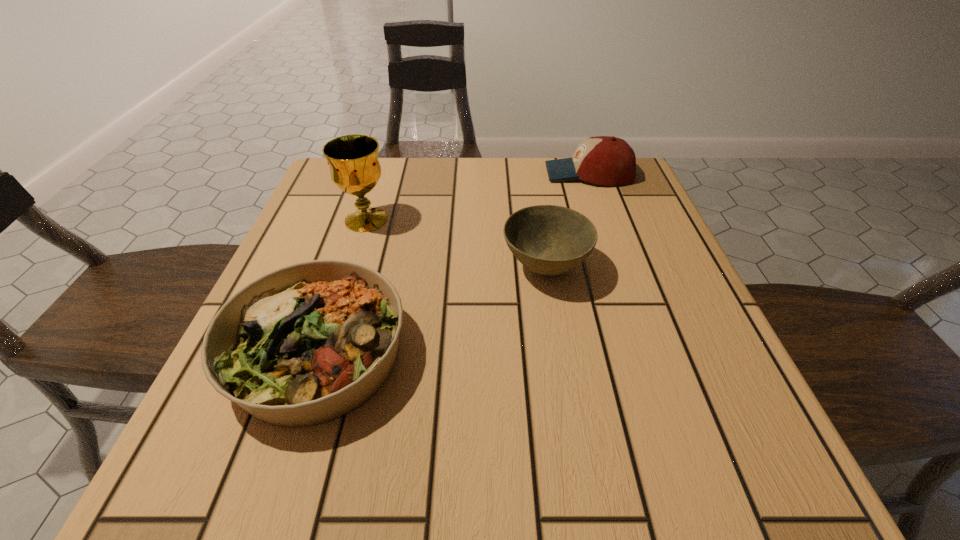
Where is `free space between the tallest object and the bowl`? This screenshot has width=960, height=540. free space between the tallest object and the bowl is located at coordinates (456, 244).

Locate an element on the screen. This screenshot has height=540, width=960. free spot between the bowl and the salad plate is located at coordinates (432, 311).

The height and width of the screenshot is (540, 960). What are the coordinates of `empty space that is in between the baseball cap and the tallest object` in the screenshot? It's located at (477, 197).

At what (x,y) coordinates should I click in order to perform the action: click on blank region between the chalice and the baseball cap. Please return your answer as a coordinate pair (x, y). Looking at the image, I should click on [x=477, y=197].

Select which object is the second closest to the bowl. Please provide its 2D coordinates. Your answer should be formatted as a tuple, i.e. [(x, y)], where the tuple contains the x and y coordinates of a point satisfying the conditions above.

[(604, 160)]

This screenshot has height=540, width=960. I want to click on object identified as the second closest to the tallest object, so click(550, 240).

Find the location of a particular element. The image size is (960, 540). vacant space that satisfies the following two spatial constraints: 1. on the front-facing side of the baseball cap; 2. on the front side of the bowl is located at coordinates (622, 267).

The height and width of the screenshot is (540, 960). In order to click on vacant position in the image that satisfies the following two spatial constraints: 1. on the front-facing side of the farthest object; 2. on the front side of the bowl in this screenshot , I will do `click(622, 267)`.

I want to click on free space that satisfies the following two spatial constraints: 1. on the front-facing side of the baseball cap; 2. on the front side of the chalice, so click(x=605, y=220).